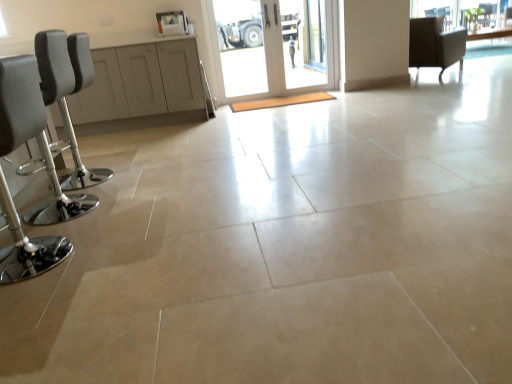
This screenshot has height=384, width=512. What are the coordinates of `clear glass window at upper right` in the screenshot? It's located at (438, 11).

Where is `matte gray cabinet at left`? The height and width of the screenshot is (384, 512). matte gray cabinet at left is located at coordinates (140, 82).

Is white glossy door at center located outside transparent glass door at center?

No, most part of white glossy door at center lies within transparent glass door at center.

Can you tell me how much white glossy door at center and transparent glass door at center differ in facing direction?

white glossy door at center and transparent glass door at center are facing 0.000111 degrees away from each other.

Is white glossy door at center facing away from transparent glass door at center?

Absolutely, white glossy door at center is directed away from transparent glass door at center.

Does white glossy door at center appear on the right side of transparent glass door at center?

No, white glossy door at center is not to the right of transparent glass door at center.

Is dark gray fabric chair at upper right, which is the 3th chair from front to back, facing towards metallic chrome barstool at left, the first chair when ordered from front to back?

No, dark gray fabric chair at upper right, which is the 3th chair from front to back, is not oriented towards metallic chrome barstool at left, the first chair when ordered from front to back.

Is point (435, 46) more distant than point (31, 56)?

That is True.

Is dark gray fabric chair at upper right, which is counted as the third chair, starting from the left, next to metallic chrome barstool at left, which is the third chair in top-to-bottom order?

Answer: No, dark gray fabric chair at upper right, which is counted as the third chair, starting from the left, is not beside metallic chrome barstool at left, which is the third chair in top-to-bottom order.

Is dark gray fabric chair at upper right, which is counted as the third chair, starting from the left, not within metallic chrome barstool at left, the first chair when ordered from front to back?

dark gray fabric chair at upper right, which is counted as the third chair, starting from the left, is positioned outside metallic chrome barstool at left, the first chair when ordered from front to back.

Consider the image. From the image's perspective, who appears lower, clear glass window at upper right or dark gray fabric chair at upper right, which is counted as the 3th chair, starting from the bottom?

dark gray fabric chair at upper right, which is counted as the 3th chair, starting from the bottom, is shown below in the image.

Is clear glass window at upper right wider or thinner than dark gray fabric chair at upper right, placed as the 1th chair when sorted from right to left?

In the image, clear glass window at upper right appears to be more narrow than dark gray fabric chair at upper right, placed as the 1th chair when sorted from right to left.

The width and height of the screenshot is (512, 384). What are the coordinates of `the 1st chair below when counting from the clear glass window at upper right (from the image's perspective)` in the screenshot? It's located at (435, 45).

Considering the sizes of objects dark gray fabric chair at upper right, which is counted as the 3th chair, starting from the bottom, and clear glass window at upper right in the image provided, who is shorter, dark gray fabric chair at upper right, which is counted as the 3th chair, starting from the bottom, or clear glass window at upper right?

Answer: With less height is clear glass window at upper right.

Find the location of `window that appears behind the dark gray fabric chair at upper right, positioned as the first chair in back-to-front order`. window that appears behind the dark gray fabric chair at upper right, positioned as the first chair in back-to-front order is located at coordinates (438, 11).

Considering the positions of point (432, 56) and point (450, 13), is point (432, 56) closer or farther from the camera than point (450, 13)?

Point (432, 56) is positioned closer to the camera compared to point (450, 13).

From the image's perspective, which one is positioned lower, dark gray fabric chair at upper right, arranged as the first chair when viewed from the top, or clear glass window at upper right?

dark gray fabric chair at upper right, arranged as the first chair when viewed from the top, from the image's perspective.

From the image's perspective, is matte gray cabinet at left above or below clear glass window screen at upper right?

From the image's perspective, matte gray cabinet at left appears below clear glass window screen at upper right.

Is point (84, 98) positioned in front of point (465, 14)?

That is True.

Between matte gray cabinet at left and clear glass window screen at upper right, which one has smaller width?

With smaller width is clear glass window screen at upper right.

Can you confirm if matte gray cabinet at left is bigger than clear glass window screen at upper right?

Correct, matte gray cabinet at left is larger in size than clear glass window screen at upper right.

Considering the relative positions of white glossy door at center and matte gray cabinet at left in the image provided, is white glossy door at center to the left of matte gray cabinet at left from the viewer's perspective?

In fact, white glossy door at center is to the right of matte gray cabinet at left.

Is white glossy door at center taller or shorter than matte gray cabinet at left?

In the image, white glossy door at center appears to be taller than matte gray cabinet at left.

Is white glossy door at center located outside matte gray cabinet at left?

Yes, white glossy door at center is located beyond the bounds of matte gray cabinet at left.

Considering the points (79, 205) and (218, 6), which point is behind, point (79, 205) or point (218, 6)?

The point (218, 6) is more distant.

From a real-world perspective, is black leather barstool at left, acting as the second chair starting from the back, physically above white glossy door at center?

No, from a real-world perspective, black leather barstool at left, acting as the second chair starting from the back, is not over white glossy door at center

Is black leather barstool at left, the second chair ordered from the bottom, far away from white glossy door at center?

Yes, black leather barstool at left, the second chair ordered from the bottom, is far from white glossy door at center.

At what (x,y) coordinates should I click in order to perform the action: click on door in front of the transparent glass door at center. Please return your answer as a coordinate pair (x, y). Image resolution: width=512 pixels, height=384 pixels. Looking at the image, I should click on (286, 54).

From a real-world perspective, starting from the dark gray fabric chair at upper right, which is the 3th chair from front to back, which chair is the 1st one vertically above it? Please provide its 2D coordinates.

[(19, 102)]

From the image, which object appears to be nearer to white glossy door at center, black leather barstool at left, the third chair positioned from the right, or transparent glass door at center?

transparent glass door at center.

Estimate the real-world distances between objects in this image. Which object is closer to metallic chrome barstool at left, the first chair when ordered from front to back, white glossy door at center or matte gray cabinet at left?

matte gray cabinet at left is closer to metallic chrome barstool at left, the first chair when ordered from front to back.

Consider the image. Considering their positions, is metallic chrome barstool at left, which is the third chair in top-to-bottom order, positioned further to black leather barstool at left, arranged as the 2th chair when viewed from the front, than matte gray cabinet at left?

matte gray cabinet at left.

From the image, which object appears to be farther from black leather barstool at left, arranged as the 2th chair when viewed from the front, white glossy door at center or transparent glass door at center?

transparent glass door at center is positioned further to the anchor black leather barstool at left, arranged as the 2th chair when viewed from the front.

Estimate the real-world distances between objects in this image. Which object is closer to metallic chrome barstool at left, which is the 3th chair in back-to-front order, dark gray fabric chair at upper right, arranged as the first chair when viewed from the top, or clear glass window screen at upper right?

dark gray fabric chair at upper right, arranged as the first chair when viewed from the top.

Considering their positions, is black leather barstool at left, the second chair ordered from the bottom, positioned closer to clear glass window at upper right than dark gray fabric chair at upper right, arranged as the first chair when viewed from the top?

dark gray fabric chair at upper right, arranged as the first chair when viewed from the top.

Based on their spatial positions, is dark gray fabric chair at upper right, positioned as the first chair in back-to-front order, or matte gray cabinet at left further from clear glass window screen at upper right?

matte gray cabinet at left is further to clear glass window screen at upper right.

From the picture: When comparing their distances from matte gray cabinet at left, does dark gray fabric chair at upper right, placed as the 1th chair when sorted from right to left, or clear glass window at upper right seem closer?

Among the two, dark gray fabric chair at upper right, placed as the 1th chair when sorted from right to left, is located nearer to matte gray cabinet at left.

Identify the location of cabinetry located between metallic chrome barstool at left, the first chair when ordered from front to back, and clear glass window screen at upper right in the depth direction. (140, 82).

Locate an element on the screen. screen door between black leather barstool at left, the first chair positioned from the left, and clear glass window at upper right, along the z-axis is located at coordinates (306, 42).

You are a GUI agent. You are given a task and a screenshot of the screen. Output one action in this format:
    pyautogui.click(x=<x>, y=<y>)
    Task: Click on the chair located between transparent glass door at center and clear glass window at upper right in the depth direction
    Image resolution: width=512 pixels, height=384 pixels.
    Given the screenshot: What is the action you would take?
    pyautogui.click(x=435, y=45)

What are the coordinates of `cabinetry located between metallic chrome barstool at left, placed as the 1th chair when sorted from bottom to top, and white glossy door at center in the depth direction` in the screenshot? It's located at (140, 82).